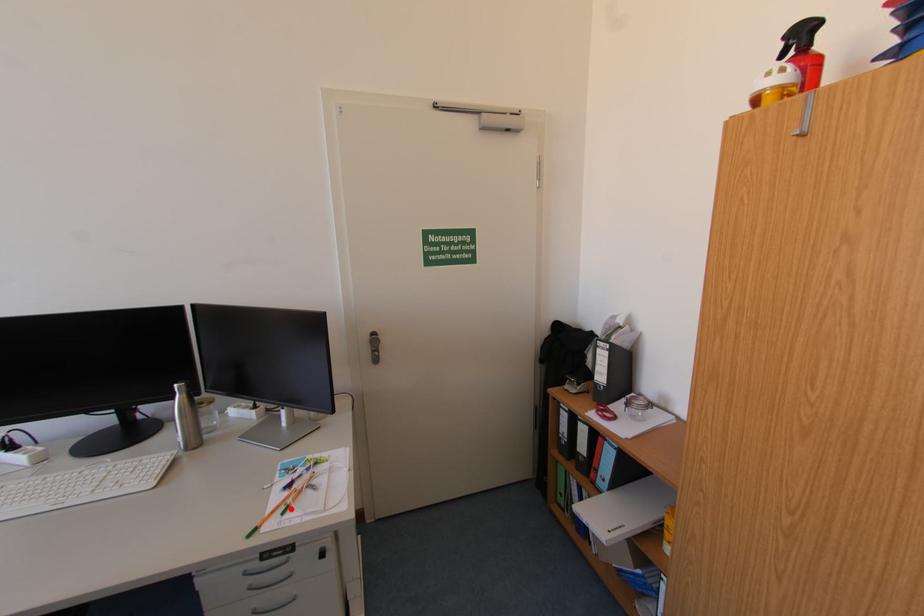
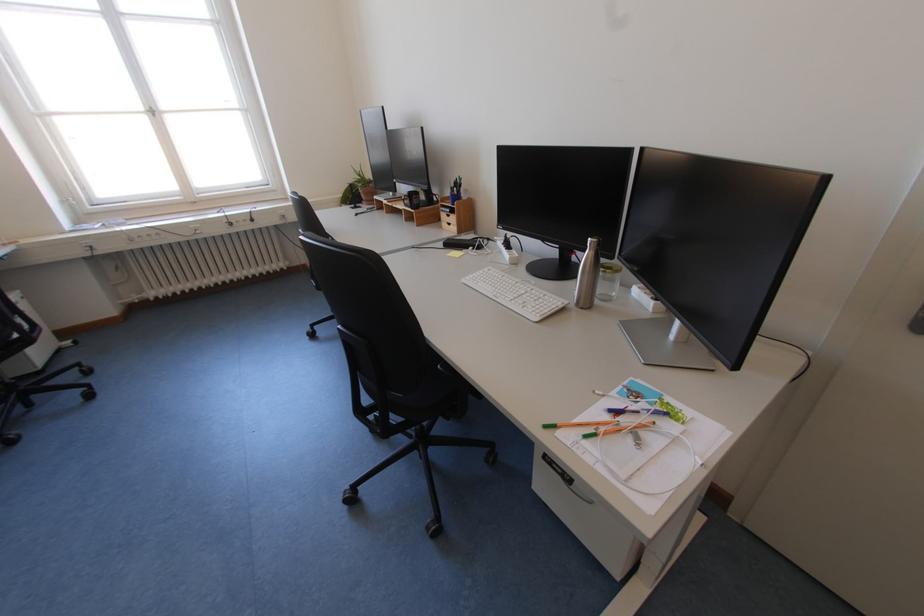
Question: I am providing you with two images of the same scene from different viewpoints. A red point is marked on the first image. At the location where the point appears in image 1, is it still visible in image 2?

Choices:
 (A) Yes
 (B) No

Answer: (A)